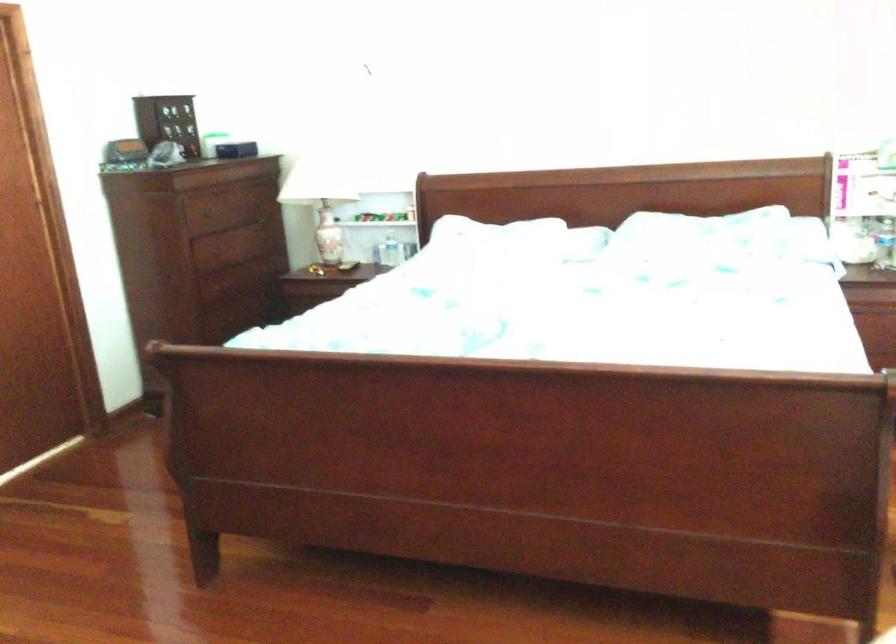
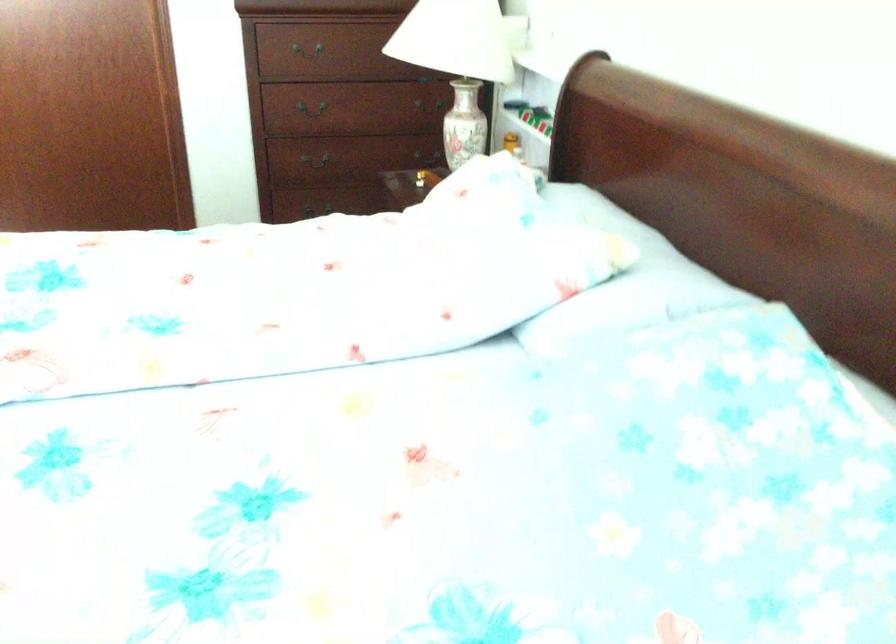
Find the pixel in the second image that matches point (220, 240) in the first image.

(309, 52)